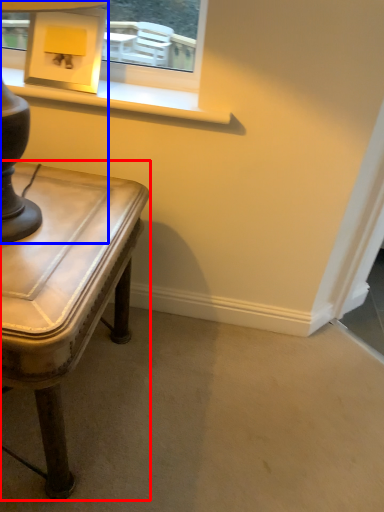
Question: Which of the following is the closest to the observer, table (highlighted by a red box) or table lamp (highlighted by a blue box)?

Choices:
 (A) table
 (B) table lamp

Answer: (B)